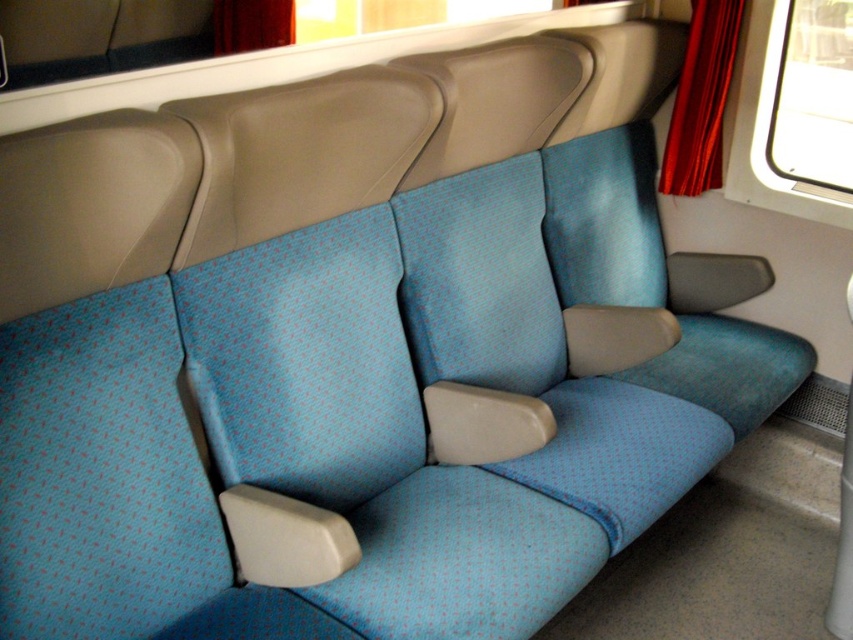
You are a passenger on a train and want to enjoy the view outside. There is a transparent glass window at upper right and a velvet red curtain at upper right. Can you open the curtain to see through the window? Explain why or why not based on their positions.

The transparent glass window at upper right and velvet red curtain at upper right are 9.84 inches apart from each other. Since the curtain is positioned away from the window, you can open the curtain to see through the window as they are not overlapping.

You are a passenger sitting in the middle of the train and looking up. You see the transparent glass window at upper right and the red velvet curtain at upper center. Which object is closer to your right side?

The transparent glass window at upper right is closer to your right side since it is positioned to the right of the red velvet curtain at upper center.

You are a passenger sitting in the train and want to check the height of the curtains. Which curtain is taller between the velvet red curtain at upper right and the red velvet curtain at upper center?

The velvet red curtain at upper right is taller than the red velvet curtain at upper center.